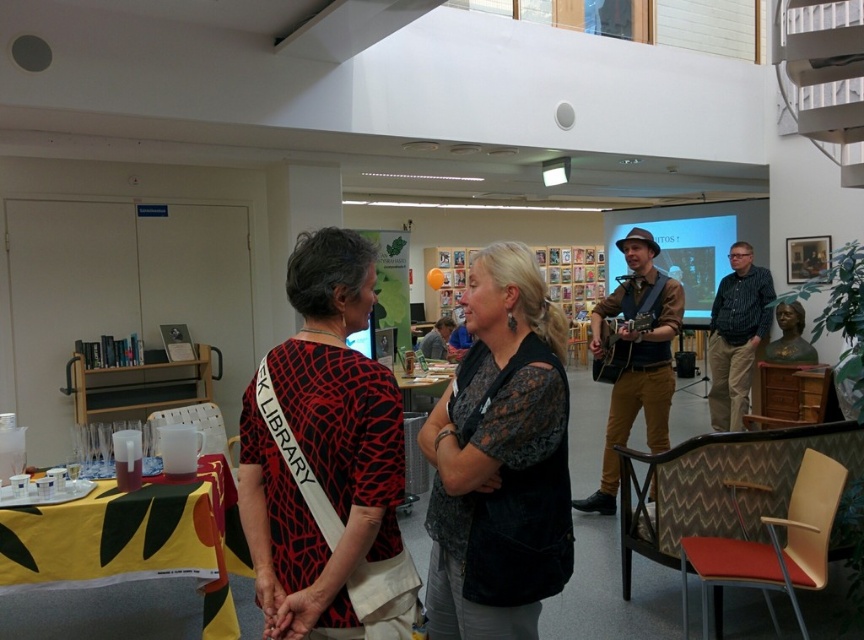
You are standing at the entrance of the library and want to take a photo of the point at coordinates (376,376). Your camera has a focal length of 50mm and you are 1.59 meters away from the point. What is the required distance in millimeters from the camera sensor to the lens to focus on the point?

The required distance is 50mm because the focal length of 50mm corresponds to the distance from the camera sensor to the lens needed to focus on objects at that distance.

You are attending an event and see two women in the center of the room. One is wearing a black printed dress at center and the other a black lace blouse at center. Which woman is positioned to the left?

The black printed dress at center is to the left of the black lace blouse at center, so the woman wearing the black printed dress at center is positioned to the left.